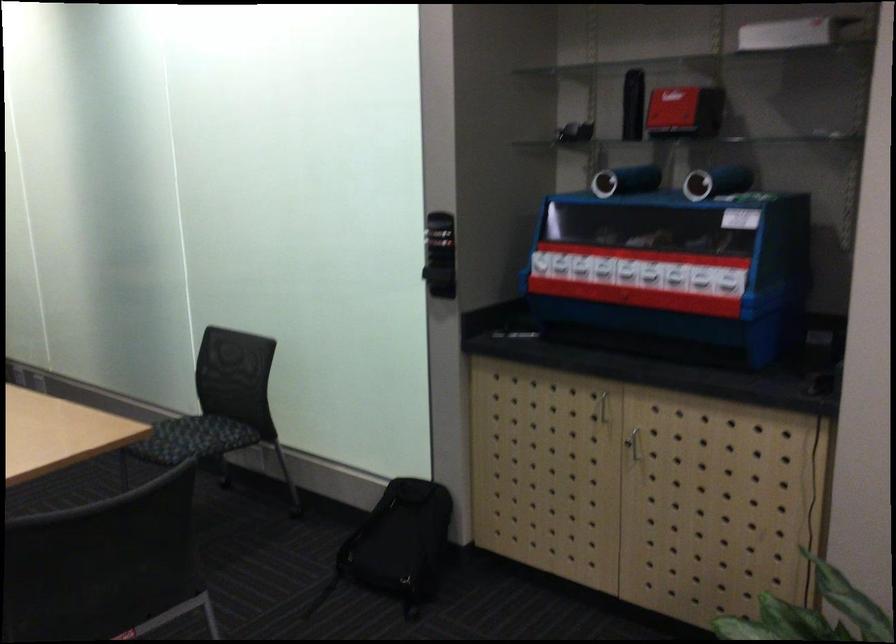
The location [730,281] corresponds to which object?

It corresponds to the white box in the image.